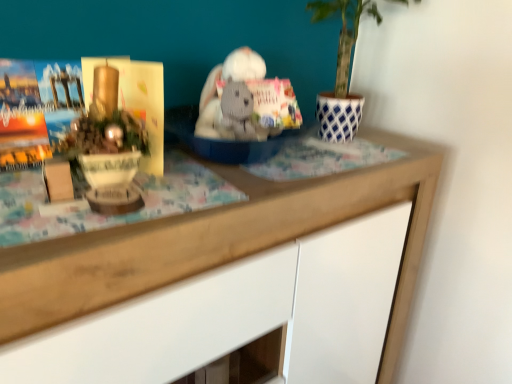
Locate an element on the screen. This screenshot has width=512, height=384. unoccupied area in front of matte gold paperback book at left is located at coordinates (111, 219).